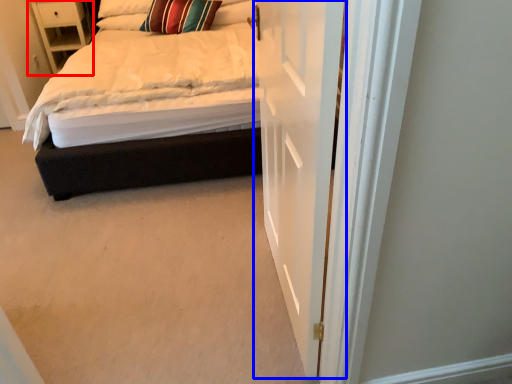
Question: Which point is further to the camera, nightstand (highlighted by a red box) or door (highlighted by a blue box)?

Choices:
 (A) nightstand
 (B) door

Answer: (A)